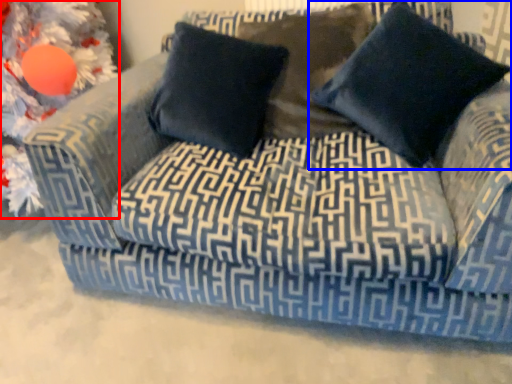
Question: Which of the following is the closest to the observer, christmas decoration (highlighted by a red box) or pillow (highlighted by a blue box)?

Choices:
 (A) christmas decoration
 (B) pillow

Answer: (B)